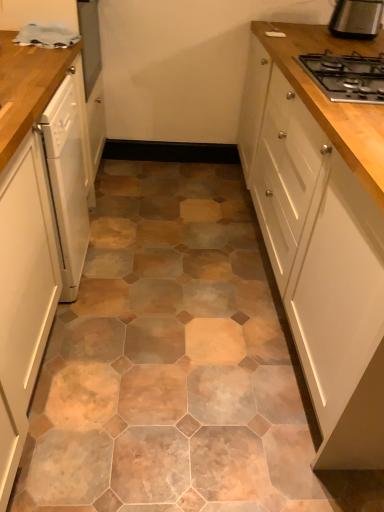
Locate an element on the screen. The image size is (384, 512). vacant point to the left of black metallic toaster at upper right is located at coordinates pyautogui.click(x=319, y=31).